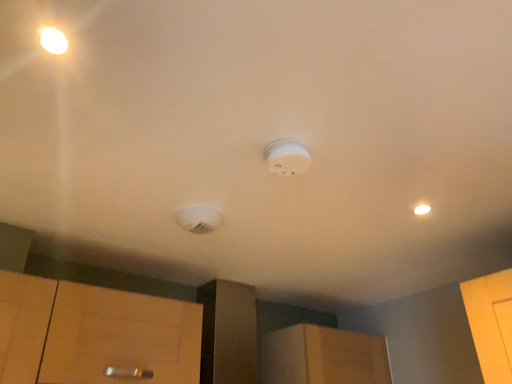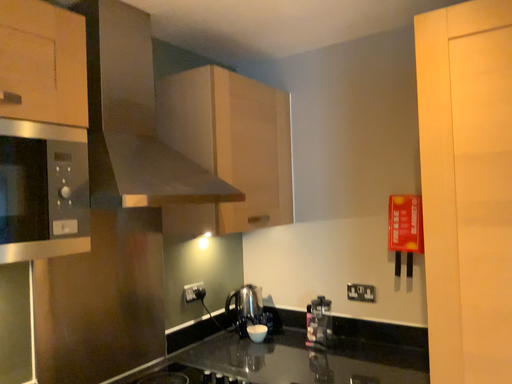
Question: Which way did the camera rotate in the video?

Choices:
 (A) rotated left
 (B) rotated right

Answer: (B)